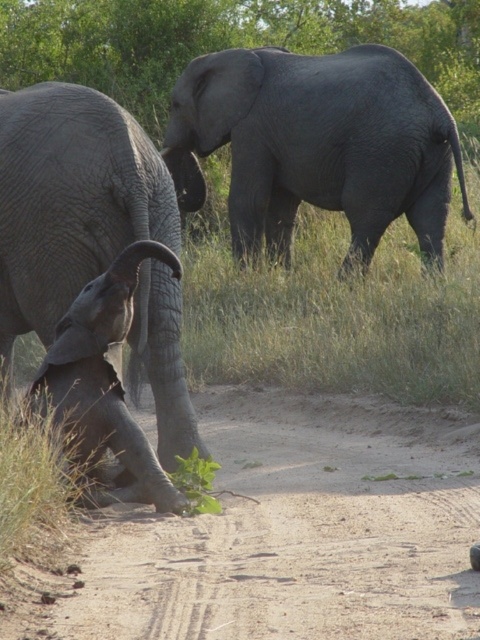
Is gray matte elephant at upper center to the right of gray wrinkled baby elephant at lower left from the viewer's perspective?

Correct, you'll find gray matte elephant at upper center to the right of gray wrinkled baby elephant at lower left.

Identify the location of gray matte elephant at upper center. Image resolution: width=480 pixels, height=640 pixels. (316, 145).

I want to click on gray matte elephant at upper center, so click(316, 145).

Does gray matte elephant at upper center appear over gray textured elephant at left?

Correct, gray matte elephant at upper center is located above gray textured elephant at left.

From the picture: Can you confirm if gray matte elephant at upper center is positioned to the left of gray textured elephant at left?

In fact, gray matte elephant at upper center is to the right of gray textured elephant at left.

The height and width of the screenshot is (640, 480). What do you see at coordinates (316, 145) in the screenshot? I see `gray matte elephant at upper center` at bounding box center [316, 145].

Locate an element on the screen. The width and height of the screenshot is (480, 640). gray matte elephant at upper center is located at coordinates (316, 145).

Which is more to the left, brown sandy dirt track at lower center or gray wrinkled baby elephant at lower left?

Positioned to the left is gray wrinkled baby elephant at lower left.

Does brown sandy dirt track at lower center have a lesser height compared to gray wrinkled baby elephant at lower left?

Yes.

Where is `brown sandy dirt track at lower center`? The width and height of the screenshot is (480, 640). brown sandy dirt track at lower center is located at coordinates (291, 532).

Find the location of a particular element. brown sandy dirt track at lower center is located at coordinates (291, 532).